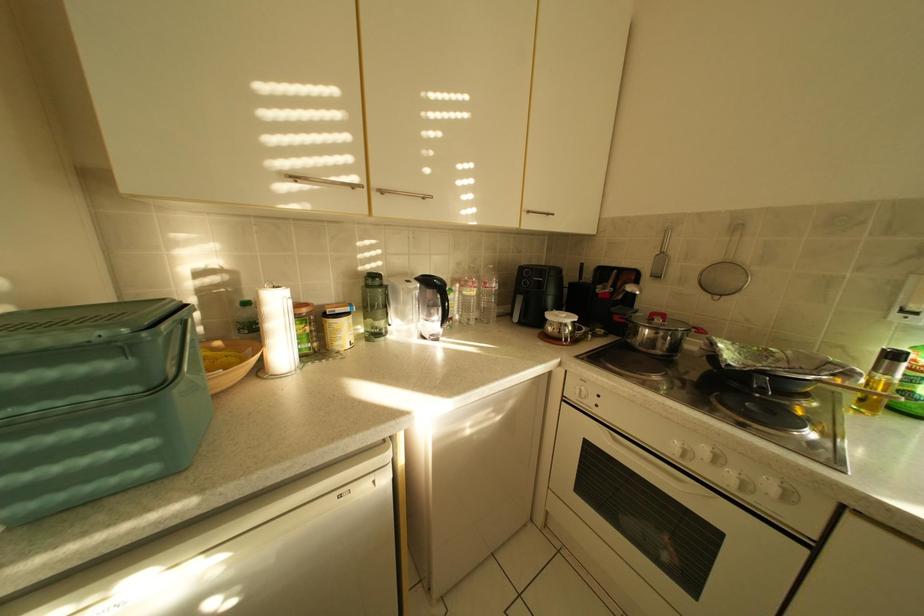
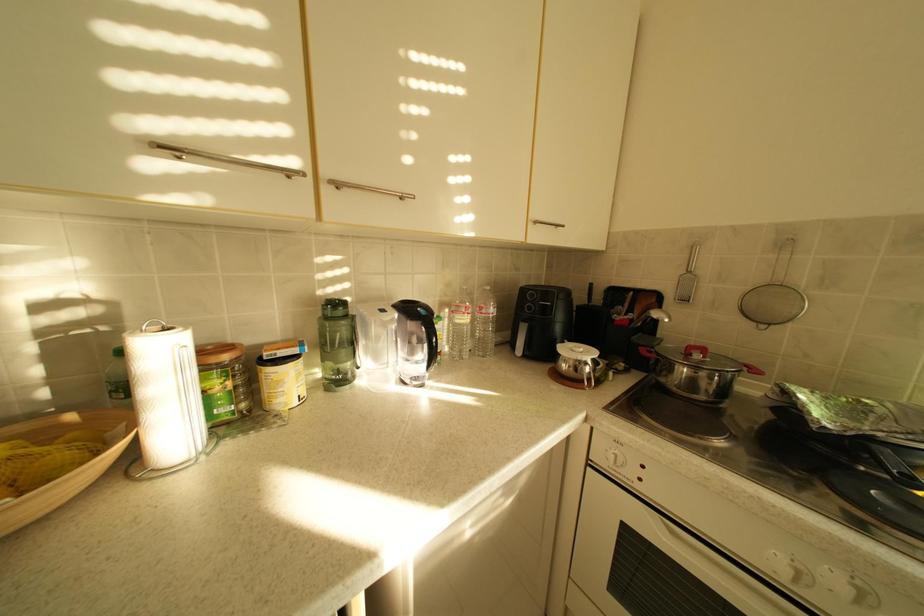
Question: In a continuous first-person perspective shot, in which direction is the camera moving?

Choices:
 (A) Left
 (B) Right
 (C) Forward
 (D) Backward

Answer: (C)